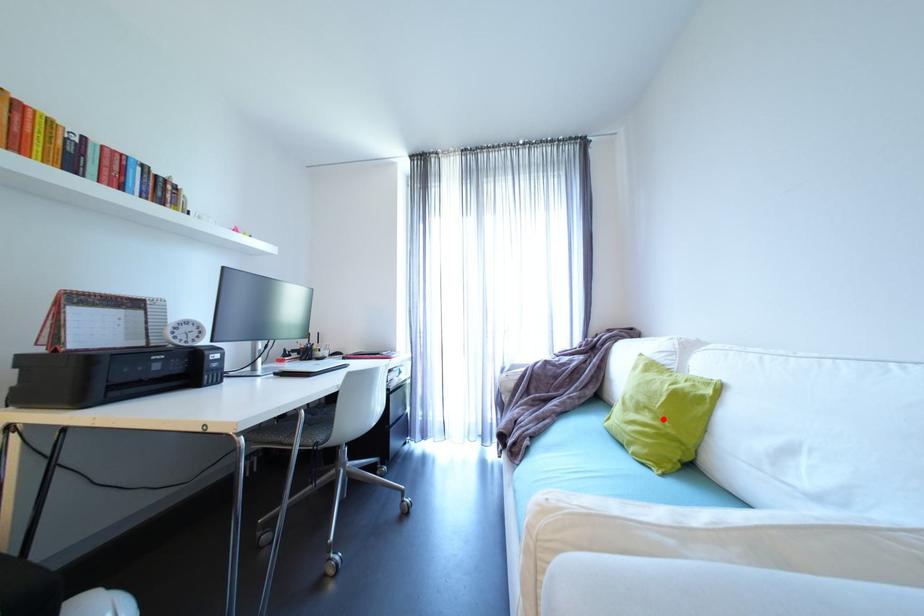
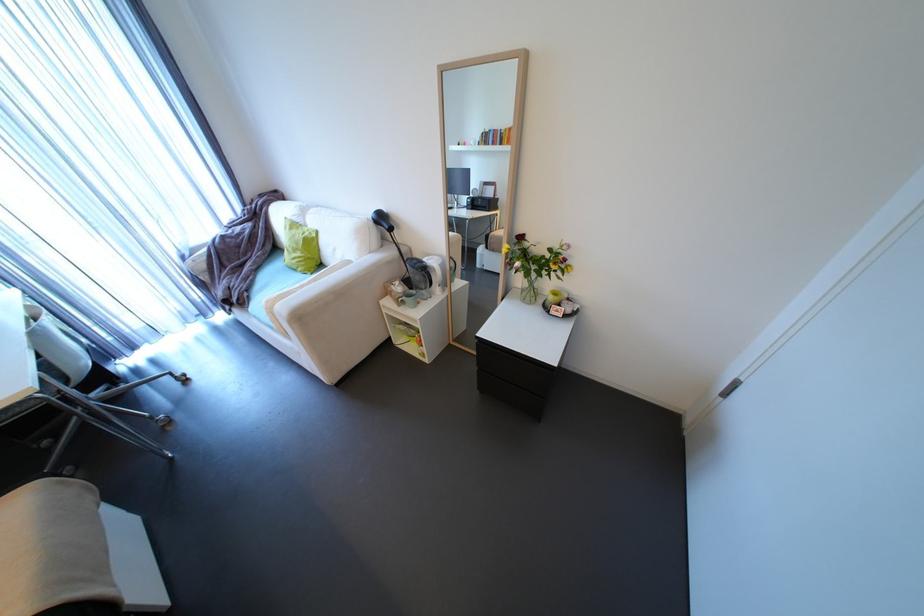
Locate, in the second image, the point that corresponds to the highlighted location in the first image.

(310, 253)